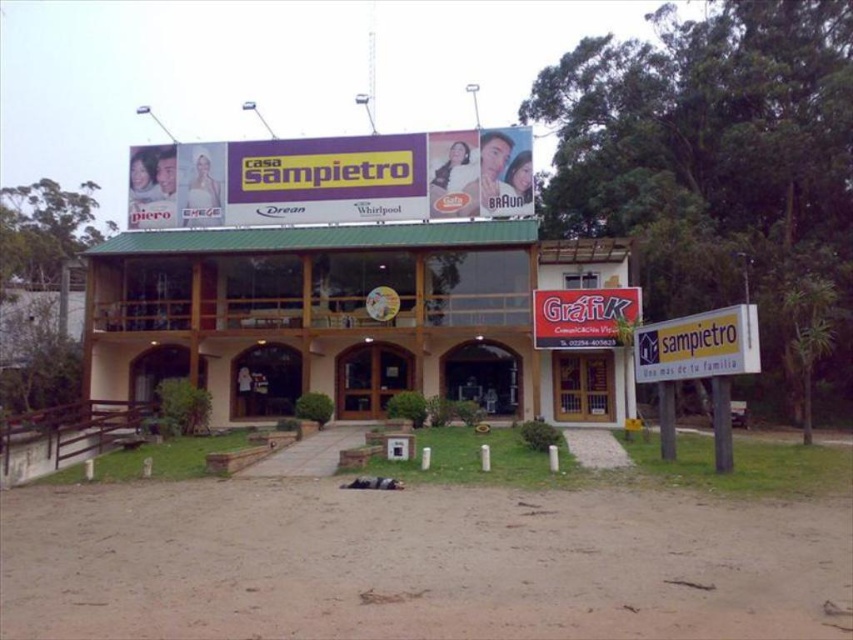
Question: Which point appears farthest from the camera in this image?

Choices:
 (A) (585, 296)
 (B) (720, 346)
 (C) (454, 236)

Answer: (C)

Question: Can you confirm if brown wooden hotel at center is positioned above white plastic sign at lower right?

Choices:
 (A) no
 (B) yes

Answer: (B)

Question: Is brown wooden hotel at center to the left of white plastic sign at lower right from the viewer's perspective?

Choices:
 (A) yes
 (B) no

Answer: (A)

Question: Which of the following is the closest to the observer?

Choices:
 (A) (634, 310)
 (B) (750, 362)
 (C) (219, 321)

Answer: (B)

Question: Which is nearer to the red plastic sign at center?

Choices:
 (A) white plastic sign at lower right
 (B) brown wooden hotel at center

Answer: (B)

Question: Can you confirm if brown wooden hotel at center is positioned below white plastic sign at lower right?

Choices:
 (A) no
 (B) yes

Answer: (A)